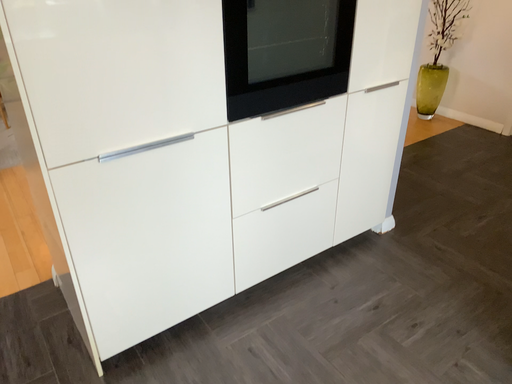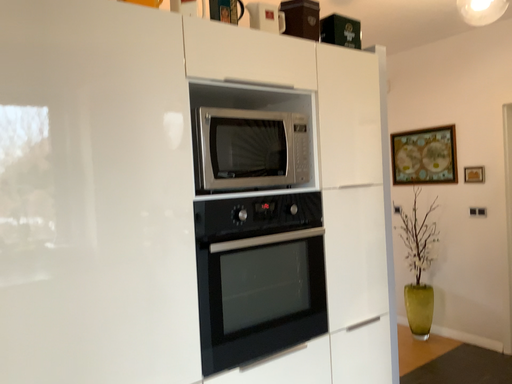
Question: Which way did the camera rotate in the video?

Choices:
 (A) rotated upward
 (B) rotated downward

Answer: (A)